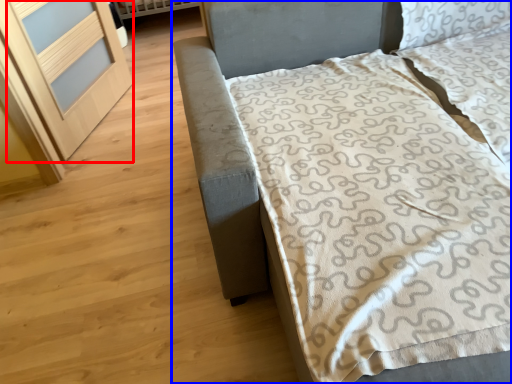
Question: Which point is further to the camera, screen door (highlighted by a red box) or bed (highlighted by a blue box)?

Choices:
 (A) screen door
 (B) bed

Answer: (A)